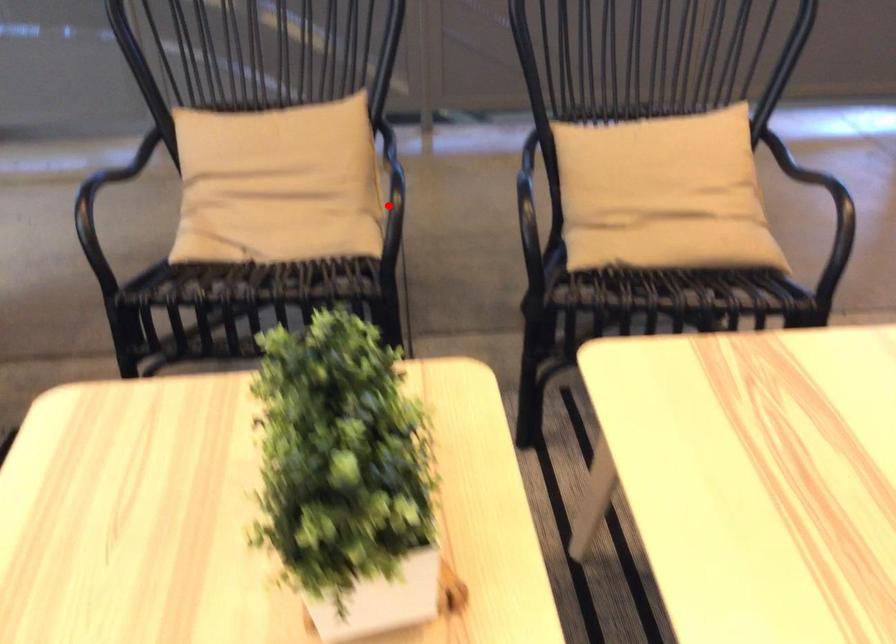
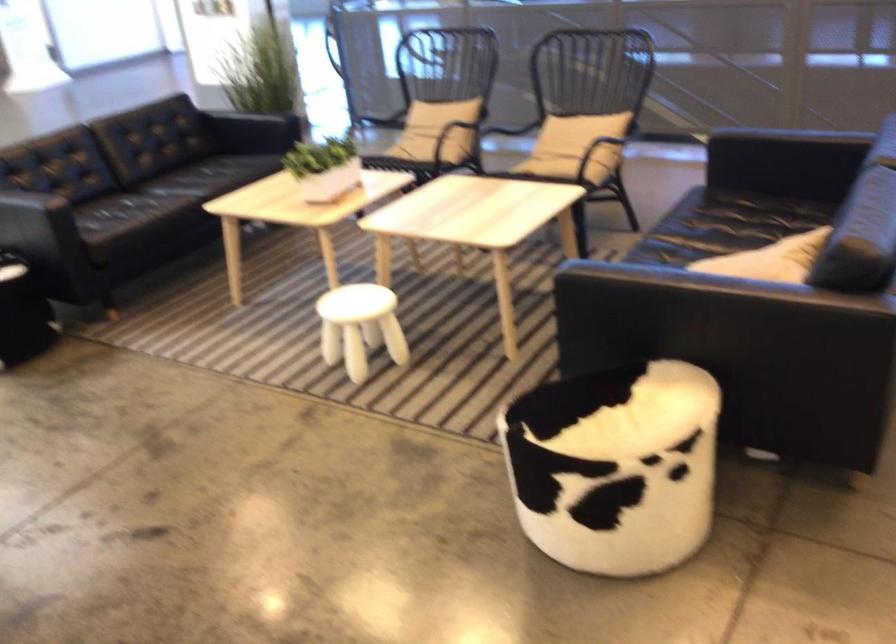
Where in the second image is the point corresponding to the highlighted location from the first image?

(450, 135)